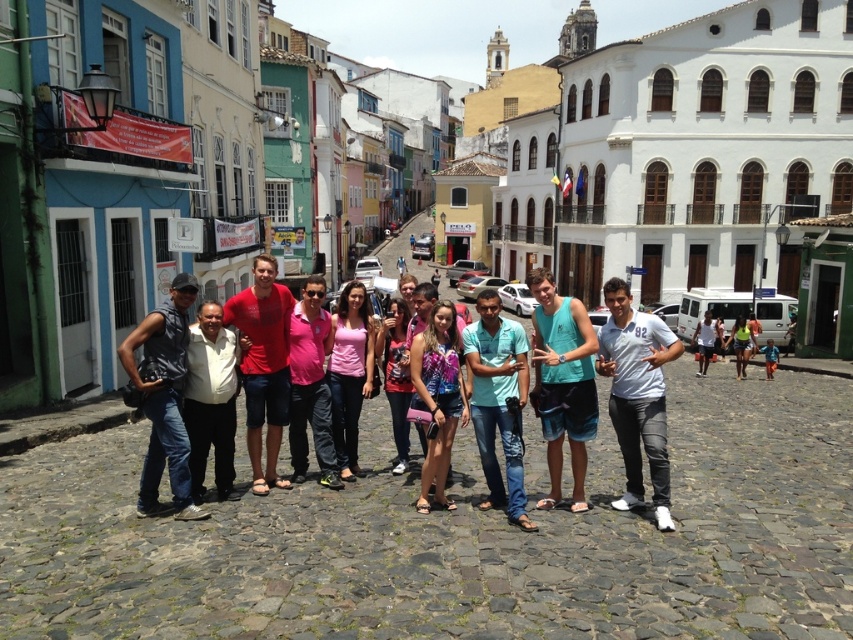
Which is more to the left, denim jeans at left or pink matte tank top at center?

denim jeans at left

Can you confirm if denim jeans at left is bigger than pink matte tank top at center?

Incorrect, denim jeans at left is not larger than pink matte tank top at center.

In order to click on denim jeans at left in this screenshot , I will do `click(163, 397)`.

At what (x,y) coordinates should I click in order to perform the action: click on denim jeans at left. Please return your answer as a coordinate pair (x, y). Looking at the image, I should click on (163, 397).

Between teal fabric shorts at center and matte pink shirt at center, which one appears on the left side from the viewer's perspective?

Positioned to the left is matte pink shirt at center.

Does point (595, 406) come in front of point (383, 353)?

That is True.

Locate an element on the screen. This screenshot has height=640, width=853. teal fabric shorts at center is located at coordinates (561, 381).

You are a GUI agent. You are given a task and a screenshot of the screen. Output one action in this format:
    pyautogui.click(x=<x>, y=<y>)
    Task: Click on the teal fabric shorts at center
    This screenshot has width=853, height=640.
    Given the screenshot: What is the action you would take?
    pyautogui.click(x=561, y=381)

Is teal fabric shorts at center thinner than pink matte tank top at center?

No, teal fabric shorts at center is not thinner than pink matte tank top at center.

Who is more distant from viewer, [550,435] or [334,333]?

Point [334,333]

Locate an element on the screen. teal fabric shorts at center is located at coordinates (561, 381).